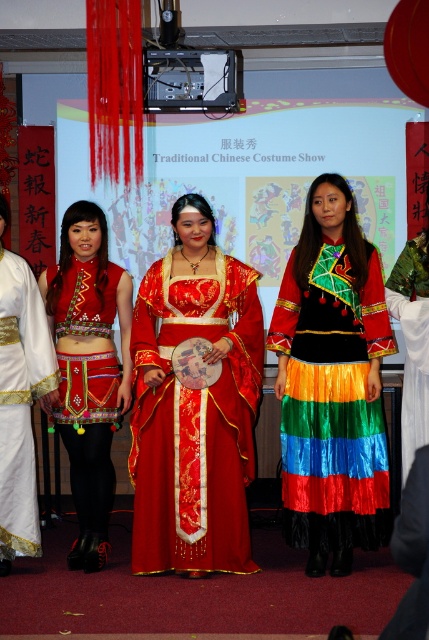
Question: Is silky red dress at center bigger than silk red dress at center?

Choices:
 (A) no
 (B) yes

Answer: (B)

Question: Does silky red dress at center have a greater width compared to shiny multicolored skirt at center?

Choices:
 (A) yes
 (B) no

Answer: (A)

Question: Is shiny multicolored skirt at center positioned behind silk red dress at center?

Choices:
 (A) no
 (B) yes

Answer: (A)

Question: Which point is closer to the camera taking this photo?

Choices:
 (A) click(335, 524)
 (B) click(87, 541)
 (C) click(6, 346)
 (D) click(393, 317)

Answer: (A)

Question: Which of the following is the closest to the observer?

Choices:
 (A) (3, 493)
 (B) (301, 237)

Answer: (A)

Question: Which of these objects is positioned closest to the shiny multicolored skirt at center?

Choices:
 (A) silky red dress at center
 (B) silky rainbow skirt at center
 (C) silk red dress at center

Answer: (B)